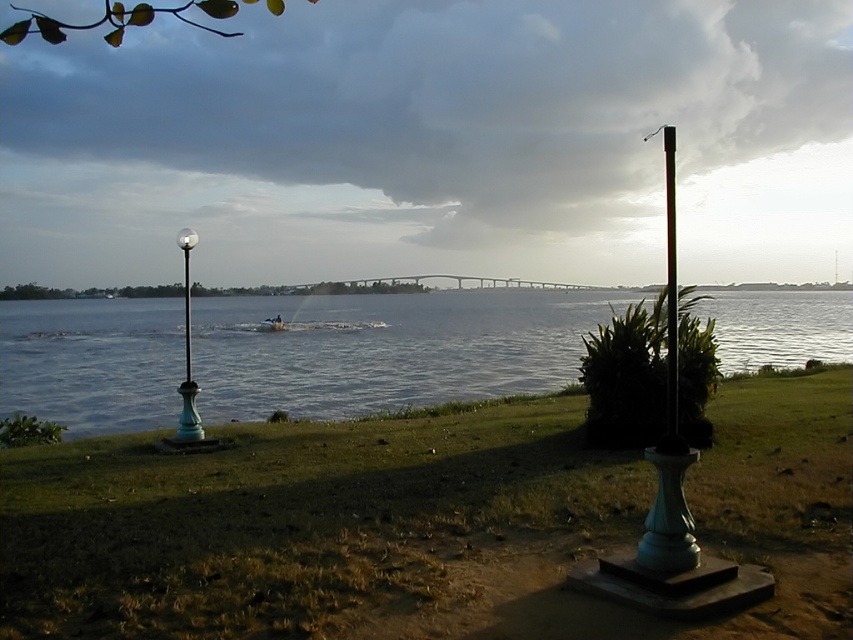
You are holding a camera and want to take a photo of the polished dark brown pole at right. If you are standing 4 meters away from it, will you need to move closer or farther away to capture the entire pole in your shot?

The polished dark brown pole at right is 4.70 meters away from the camera. Since you are currently 4 meters away, you need to move 0.70 meters farther away to match the required distance for capturing the entire pole in your shot.

You are standing on the grassy area near the riverside and want to cross to the other side. You see the clear water at center and the polished dark brown pole at right. Which direction should you head towards to reach the water first?

To reach the clear water at center first, you should head towards the left direction since the clear water at center is to the left of the polished dark brown pole at right.

Consider the image. You are walking along the riverside path and see the polished dark brown pole at right and the green glass lamp post at left. Which lamp post is positioned to the right of the other?

The polished dark brown pole at right is positioned to the right of the green glass lamp post at left.